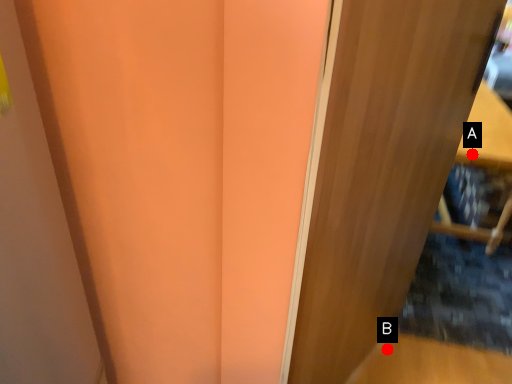
Question: Two points are circled on the image, labeled by A and B beside each circle. Which point is closer to the camera?

Choices:
 (A) A is closer
 (B) B is closer

Answer: (B)